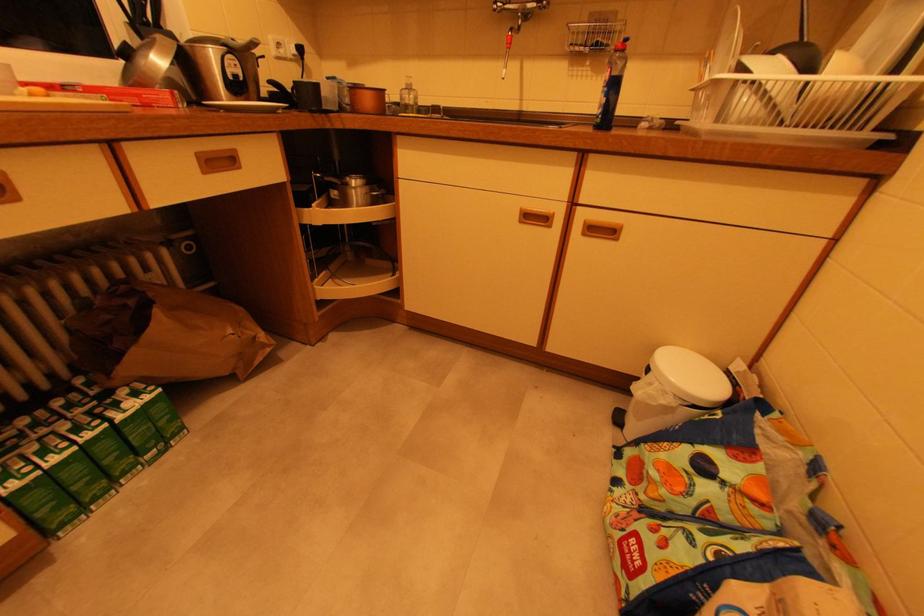
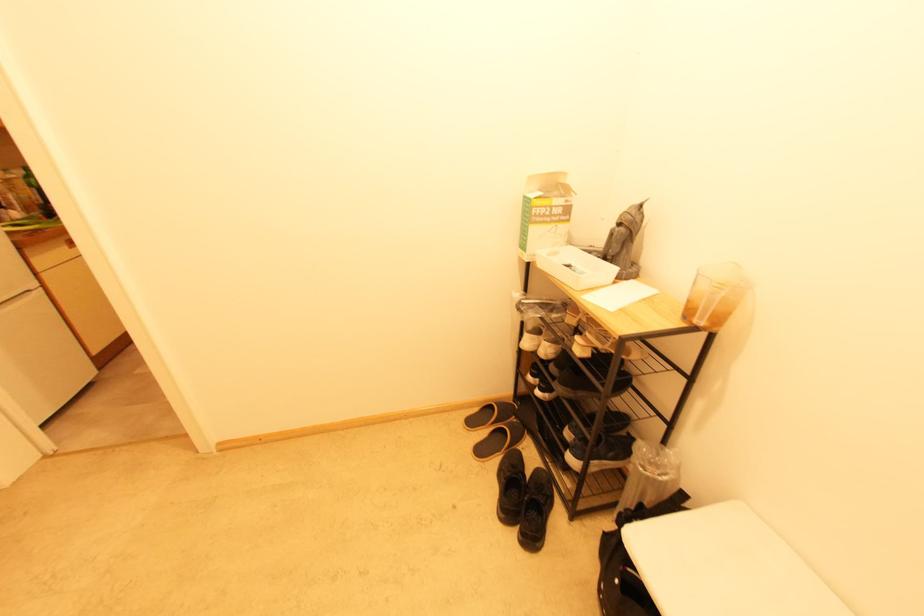
Question: I am providing you with two images of the same scene from different viewpoints. Please identify which objects are invisible in image2.

Choices:
 (A) white canister lid
 (B) bottle pump
 (C) black slipper
 (D) black sneaker

Answer: (B)